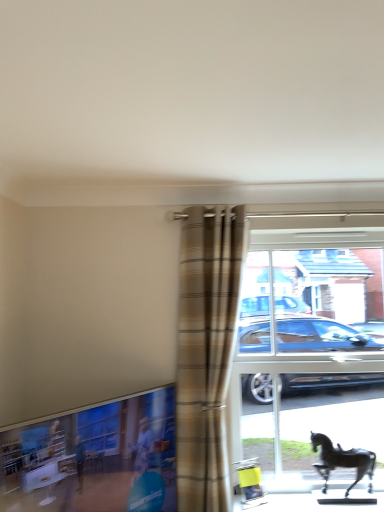
Question: Does transparent glass horse at right have a lesser width compared to plaid fabric curtain at center?

Choices:
 (A) no
 (B) yes

Answer: (B)

Question: Can you confirm if transparent glass horse at right is bigger than plaid fabric curtain at center?

Choices:
 (A) no
 (B) yes

Answer: (B)

Question: From the image's perspective, would you say transparent glass horse at right is positioned over plaid fabric curtain at center?

Choices:
 (A) no
 (B) yes

Answer: (A)

Question: From a real-world perspective, is transparent glass horse at right physically above plaid fabric curtain at center?

Choices:
 (A) yes
 (B) no

Answer: (B)

Question: Can we say transparent glass horse at right lies outside plaid fabric curtain at center?

Choices:
 (A) yes
 (B) no

Answer: (A)

Question: From a real-world perspective, is clear glass window at lower left positioned above or below transparent glass horse at right?

Choices:
 (A) below
 (B) above

Answer: (A)

Question: Looking at their shapes, would you say clear glass window at lower left is wider or thinner than transparent glass horse at right?

Choices:
 (A) thin
 (B) wide

Answer: (B)

Question: Considering the positions of point (148, 423) and point (246, 317), is point (148, 423) closer or farther from the camera than point (246, 317)?

Choices:
 (A) farther
 (B) closer

Answer: (B)

Question: From the image's perspective, is clear glass window at lower left located above or below transparent glass horse at right?

Choices:
 (A) above
 (B) below

Answer: (B)

Question: Considering the positions of transparent glass horse at right and plaid fabric curtain at center in the image, is transparent glass horse at right bigger or smaller than plaid fabric curtain at center?

Choices:
 (A) big
 (B) small

Answer: (A)

Question: Looking at their shapes, would you say transparent glass horse at right is wider or thinner than plaid fabric curtain at center?

Choices:
 (A) thin
 (B) wide

Answer: (A)

Question: From the image's perspective, is transparent glass horse at right above or below plaid fabric curtain at center?

Choices:
 (A) below
 (B) above

Answer: (A)

Question: Considering the positions of transparent glass horse at right and plaid fabric curtain at center in the image, is transparent glass horse at right taller or shorter than plaid fabric curtain at center?

Choices:
 (A) short
 (B) tall

Answer: (A)

Question: Based on their positions, is clear glass window at lower left located to the left or right of shiny black horse at lower right?

Choices:
 (A) left
 (B) right

Answer: (A)

Question: Would you say clear glass window at lower left is inside or outside shiny black horse at lower right?

Choices:
 (A) inside
 (B) outside

Answer: (B)